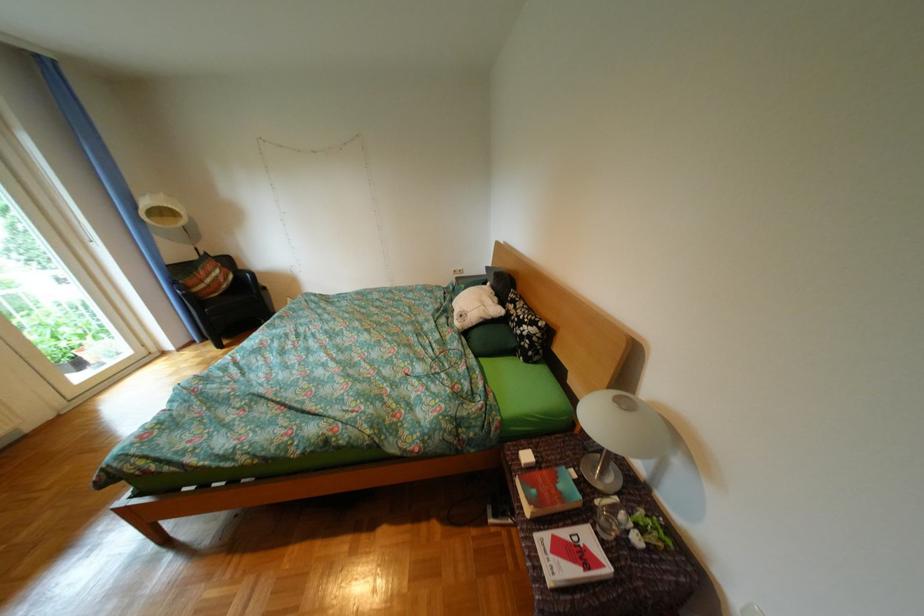
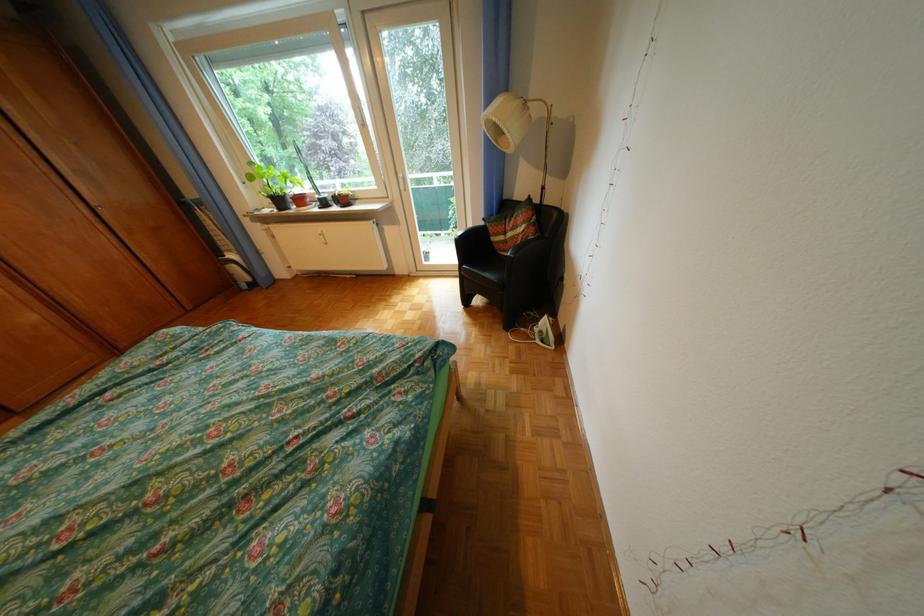
The point at [224,282] is marked in the first image. Where is the corresponding point in the second image?

(524, 236)